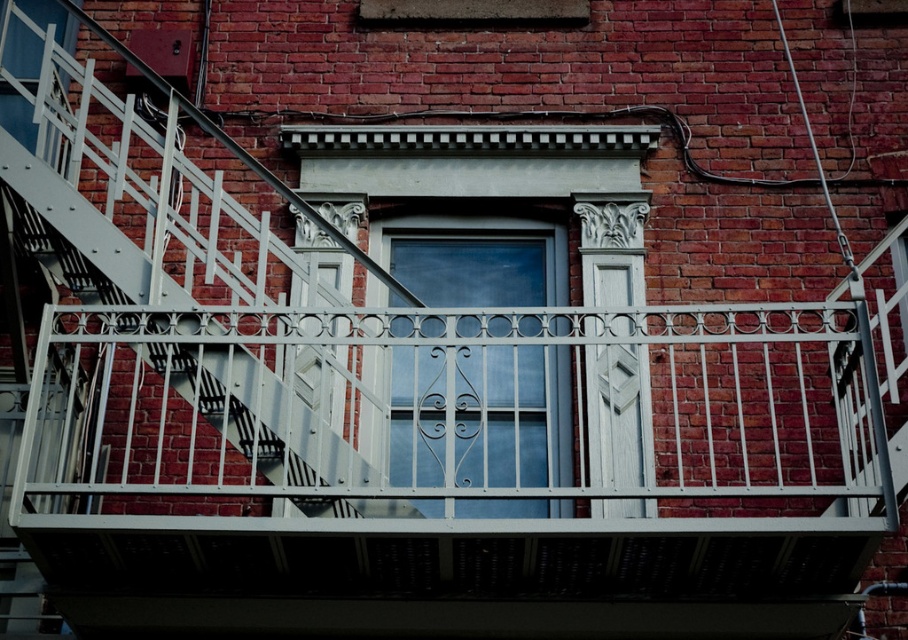
Consider the image. Between clear glass window at center and matte white window at upper left, which one appears on the right side from the viewer's perspective?

From the viewer's perspective, clear glass window at center appears more on the right side.

Does clear glass window at center appear under matte white window at upper left?

Yes.

Locate an element on the screen. The width and height of the screenshot is (908, 640). clear glass window at center is located at coordinates (476, 417).

The height and width of the screenshot is (640, 908). I want to click on clear glass window at center, so click(x=476, y=417).